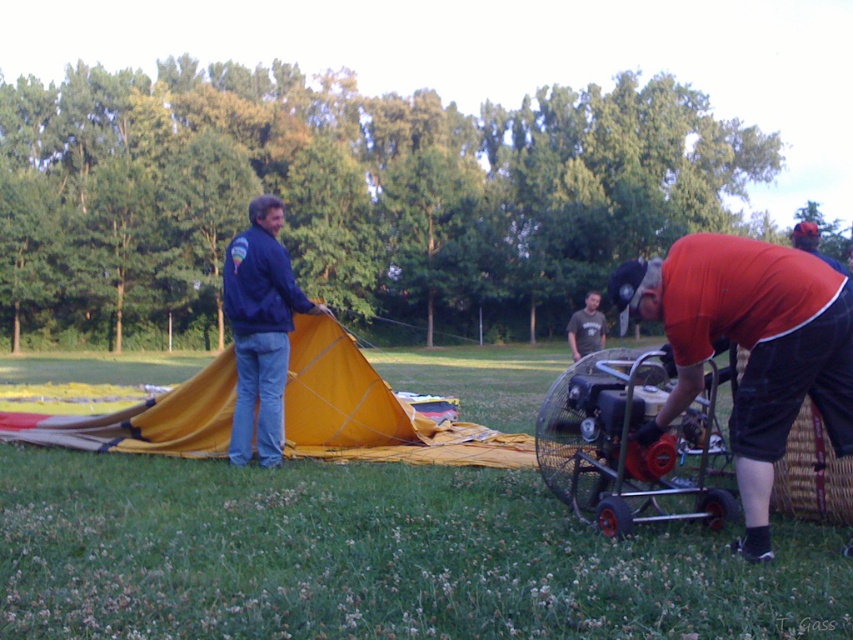
Locate an element on the screen. The height and width of the screenshot is (640, 853). orange fabric shirt at lower right is located at coordinates (750, 348).

Between orange fabric shirt at lower right and dark gray t-shirt at center, which one has more height?

Standing taller between the two is orange fabric shirt at lower right.

Which is behind, point (747, 506) or point (587, 292)?

Positioned behind is point (587, 292).

The height and width of the screenshot is (640, 853). In order to click on orange fabric shirt at lower right in this screenshot , I will do `click(750, 348)`.

Does yellow fabric tent at left have a lesser width compared to metallic red engine at center?

No, yellow fabric tent at left is not thinner than metallic red engine at center.

Between point (38, 420) and point (656, 385), which one is positioned behind?

The point (38, 420) is behind.

Between point (328, 432) and point (584, 360), which one is positioned behind?

Point (328, 432)

You are a GUI agent. You are given a task and a screenshot of the screen. Output one action in this format:
    pyautogui.click(x=<x>, y=<y>)
    Task: Click on the yellow fabric tent at left
    This screenshot has width=853, height=640.
    Given the screenshot: What is the action you would take?
    pyautogui.click(x=373, y=412)

Describe the element at coordinates (628, 444) in the screenshot. The image size is (853, 640). I see `metallic red engine at center` at that location.

Is point (550, 460) positioned after point (583, 346)?

No.

Who is more forward, (578, 396) or (601, 326)?

Point (578, 396)

You are a GUI agent. You are given a task and a screenshot of the screen. Output one action in this format:
    pyautogui.click(x=<x>, y=<y>)
    Task: Click on the metallic red engine at center
    The width and height of the screenshot is (853, 640).
    Given the screenshot: What is the action you would take?
    pyautogui.click(x=628, y=444)